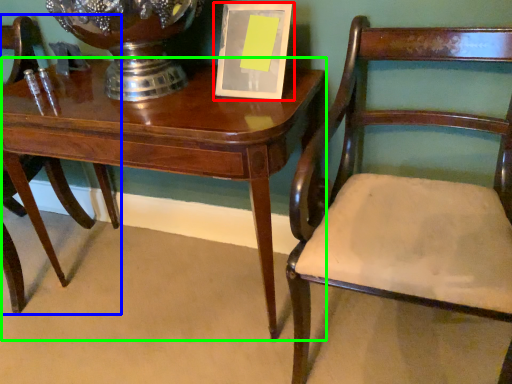
Question: Considering the real-world distances, which object is closest to picture frame (highlighted by a red box)? chair (highlighted by a blue box) or table (highlighted by a green box).

Choices:
 (A) chair
 (B) table

Answer: (B)